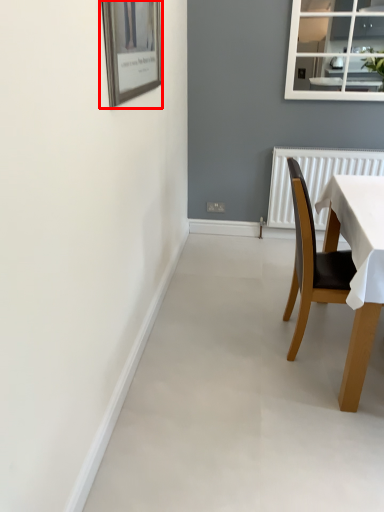
Question: From the image's perspective, considering the relative positions of picture frame (annotated by the red box) and chair in the image provided, where is picture frame (annotated by the red box) located with respect to the staircase?

Choices:
 (A) below
 (B) above

Answer: (B)